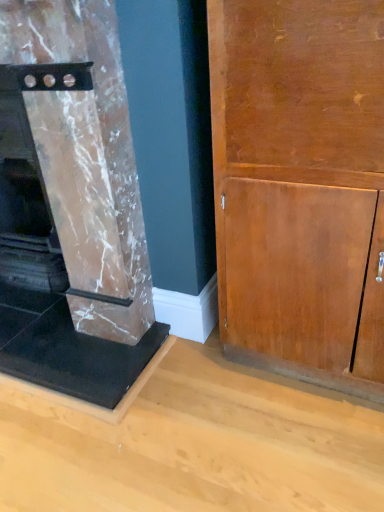
Question: From a real-world perspective, is wooden cabinet at right below marble fireplace at left?

Choices:
 (A) yes
 (B) no

Answer: (A)

Question: Does wooden cabinet at right have a lesser width compared to marble fireplace at left?

Choices:
 (A) yes
 (B) no

Answer: (A)

Question: From the image's perspective, is wooden cabinet at right below marble fireplace at left?

Choices:
 (A) yes
 (B) no

Answer: (A)

Question: Would you say marble fireplace at left is part of wooden cabinet at right's contents?

Choices:
 (A) no
 (B) yes

Answer: (A)

Question: Can you see wooden cabinet at right touching marble fireplace at left?

Choices:
 (A) no
 (B) yes

Answer: (A)

Question: From the image's perspective, does wooden cabinet at right appear higher than marble fireplace at left?

Choices:
 (A) yes
 (B) no

Answer: (B)

Question: Is marble fireplace at left touching wooden cabinet at right?

Choices:
 (A) yes
 (B) no

Answer: (B)

Question: Does marble fireplace at left have a lesser width compared to wooden cabinet at right?

Choices:
 (A) no
 (B) yes

Answer: (A)

Question: Is marble fireplace at left outside of wooden cabinet at right?

Choices:
 (A) no
 (B) yes

Answer: (B)

Question: Would you say marble fireplace at left is a long distance from wooden cabinet at right?

Choices:
 (A) yes
 (B) no

Answer: (B)

Question: From the image's perspective, is marble fireplace at left on wooden cabinet at right?

Choices:
 (A) no
 (B) yes

Answer: (B)

Question: Is marble fireplace at left shorter than wooden cabinet at right?

Choices:
 (A) yes
 (B) no

Answer: (B)

Question: Is wooden cabinet at right situated inside marble fireplace at left or outside?

Choices:
 (A) inside
 (B) outside

Answer: (B)